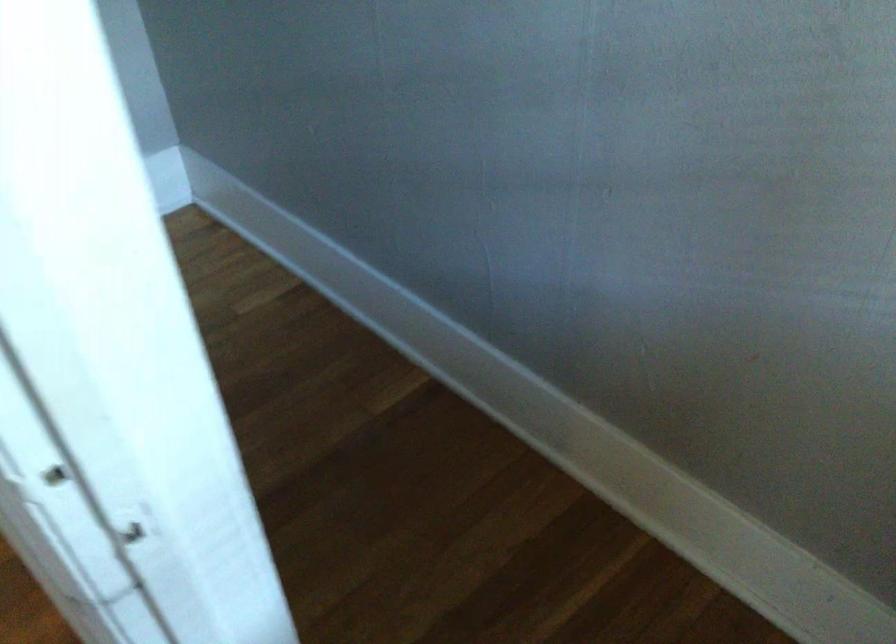
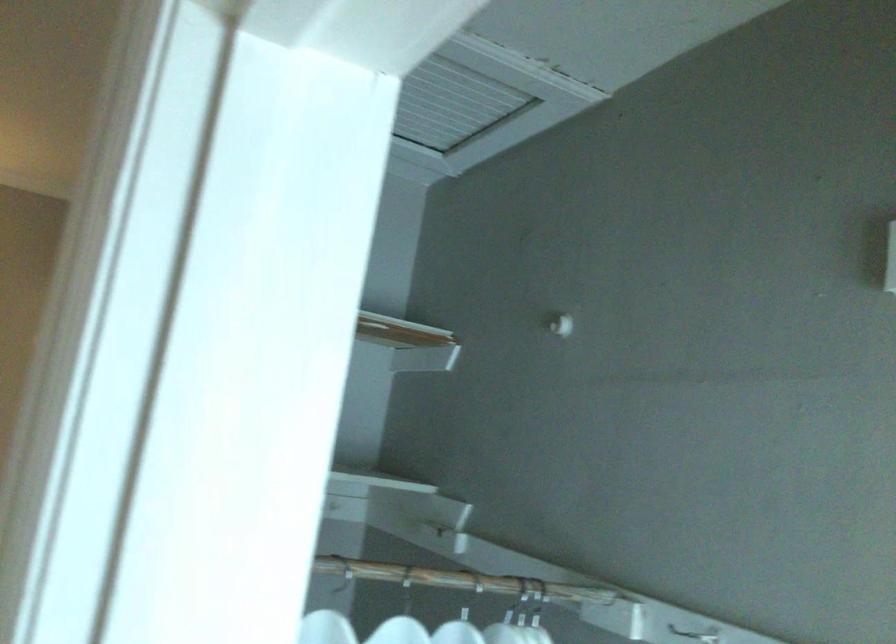
The images are taken continuously from a first-person perspective. In which direction is your viewpoint rotating?

The camera's rotation is toward left-up.